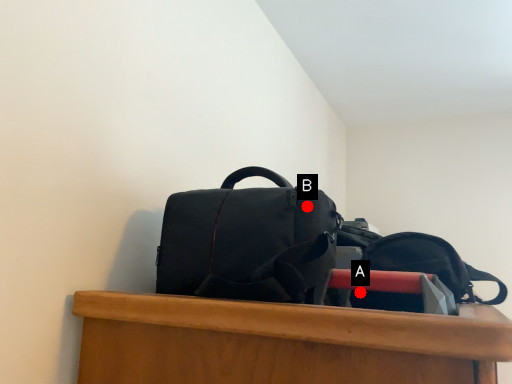
Question: Two points are circled on the image, labeled by A and B beside each circle. Which point is further to the camera?

Choices:
 (A) A is further
 (B) B is further

Answer: (A)